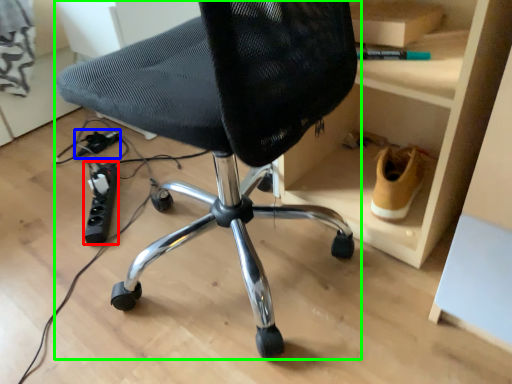
Question: Based on their relative distances, which object is farther from plug (highlighted by a red box)? Choose from plug (highlighted by a blue box) and chair (highlighted by a green box).

Choices:
 (A) plug
 (B) chair

Answer: (B)